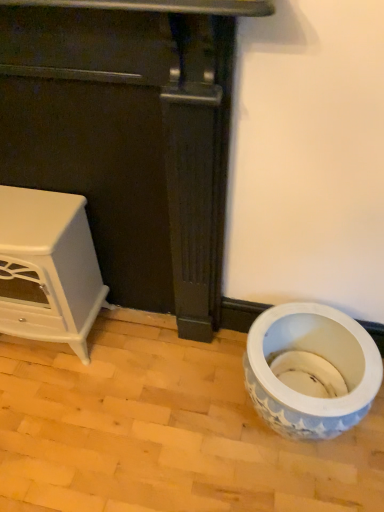
Question: Is the depth of white glossy cabinet at left, the 2th furniture when ordered from right to left, less than that of blue and white ceramic vase at lower right?

Choices:
 (A) no
 (B) yes

Answer: (A)

Question: Is white glossy cabinet at left, the 2th furniture when ordered from right to left, directly adjacent to blue and white ceramic vase at lower right?

Choices:
 (A) yes
 (B) no

Answer: (B)

Question: From the image's perspective, is white glossy cabinet at left, which is the first furniture in left-to-right order, located above blue and white ceramic vase at lower right?

Choices:
 (A) no
 (B) yes

Answer: (B)

Question: Is white glossy cabinet at left, which is the first furniture in left-to-right order, to the left of blue and white ceramic vase at lower right from the viewer's perspective?

Choices:
 (A) yes
 (B) no

Answer: (A)

Question: Can we say white glossy cabinet at left, which is the first furniture in left-to-right order, lies outside blue and white ceramic vase at lower right?

Choices:
 (A) no
 (B) yes

Answer: (B)

Question: Is blue and white ceramic vase at lower right at the back of white glossy cabinet at left, which is the first furniture in left-to-right order?

Choices:
 (A) no
 (B) yes

Answer: (A)

Question: Is white glossy cabinet at left, the 2th furniture when ordered from right to left, shorter than white glossy stove at left, which ranks as the 2th furniture in left-to-right order?

Choices:
 (A) no
 (B) yes

Answer: (B)

Question: Is there a large distance between white glossy cabinet at left, the 2th furniture when ordered from right to left, and white glossy stove at left, which ranks as the 2th furniture in left-to-right order?

Choices:
 (A) yes
 (B) no

Answer: (B)

Question: From the image's perspective, is white glossy cabinet at left, which is the first furniture in left-to-right order, above white glossy stove at left, the first furniture viewed from the right?

Choices:
 (A) yes
 (B) no

Answer: (B)

Question: Can you confirm if white glossy cabinet at left, which is the first furniture in left-to-right order, is wider than white glossy stove at left, the first furniture viewed from the right?

Choices:
 (A) yes
 (B) no

Answer: (A)

Question: From a real-world perspective, is white glossy cabinet at left, which is the first furniture in left-to-right order, on top of white glossy stove at left, which ranks as the 2th furniture in left-to-right order?

Choices:
 (A) yes
 (B) no

Answer: (B)

Question: Is white glossy cabinet at left, the 2th furniture when ordered from right to left, oriented towards white glossy stove at left, which ranks as the 2th furniture in left-to-right order?

Choices:
 (A) yes
 (B) no

Answer: (A)

Question: Considering the relative sizes of white glossy stove at left, which ranks as the 2th furniture in left-to-right order, and blue and white ceramic vase at lower right in the image provided, is white glossy stove at left, which ranks as the 2th furniture in left-to-right order, thinner than blue and white ceramic vase at lower right?

Choices:
 (A) no
 (B) yes

Answer: (B)